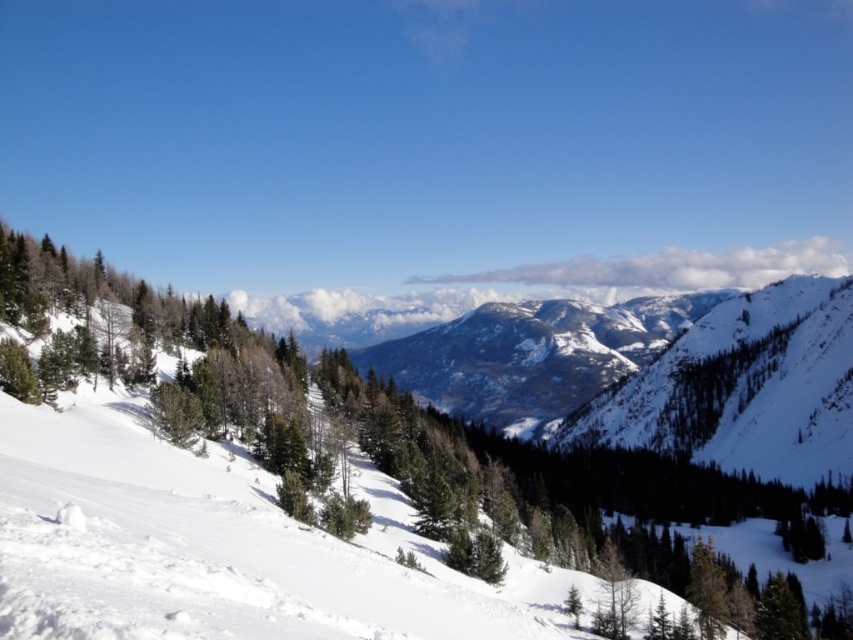
You are planning to take a photo of the snowy rocky mountain at center from the green matte tree at center. Considering their heights, will the tree block the view of the mountain?

The green matte tree at center is shorter than the snowy rocky mountain at center, so the tree will not block the view of the mountain.

You are standing at the point marked by the coordinates point (x=347, y=436) in the winter landscape. Looking around, you see the green matte tree at center. Which direction should you walk to reach the green matte tree at center?

You are already at the green matte tree at center because the point (x=347, y=436) is on the green matte tree at center.

You are an artist planning to paint this winter landscape. You want to ensure the green matte tree at center and the snowy rocky mountain at center are proportionally accurate. Which object should you paint smaller in your artwork?

The green matte tree at center should be painted smaller because it has a lesser width compared to the snowy rocky mountain at center.